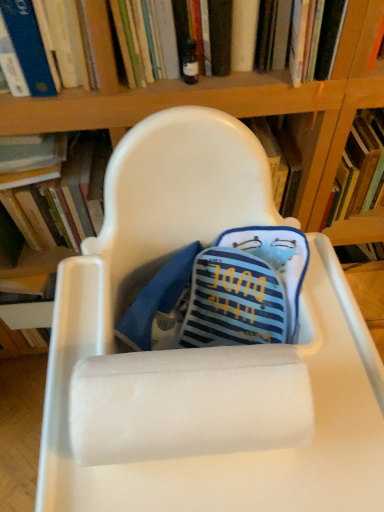
Question: Does white fluffy paper towel at center have a lesser height compared to hardcover book at upper center, the 1th book viewed from the right?

Choices:
 (A) no
 (B) yes

Answer: (B)

Question: Is white fluffy paper towel at center further to the viewer compared to hardcover book at upper center, the 3th book in the left-to-right sequence?

Choices:
 (A) no
 (B) yes

Answer: (A)

Question: Is white fluffy paper towel at center to the right of hardcover book at upper center, the 1th book viewed from the right, from the viewer's perspective?

Choices:
 (A) yes
 (B) no

Answer: (B)

Question: Could hardcover book at upper center, the 1th book viewed from the right, be considered to be inside white fluffy paper towel at center?

Choices:
 (A) yes
 (B) no

Answer: (B)

Question: Is white fluffy paper towel at center outside hardcover book at upper center, the 1th book viewed from the right?

Choices:
 (A) no
 (B) yes

Answer: (B)

Question: Is white fluffy paper towel at center not close to hardcover book at upper center, the 1th book viewed from the right?

Choices:
 (A) no
 (B) yes

Answer: (A)

Question: Considering the relative sizes of hardcover book at left, which is the third book from right to left, and hardcover book at upper center, the 1th book viewed from the right, in the image provided, is hardcover book at left, which is the third book from right to left, bigger than hardcover book at upper center, the 1th book viewed from the right,?

Choices:
 (A) yes
 (B) no

Answer: (A)

Question: Is hardcover book at left, which is the third book from right to left, taller than hardcover book at upper center, the 1th book viewed from the right?

Choices:
 (A) no
 (B) yes

Answer: (B)

Question: Can you confirm if hardcover book at left, the first book from the left, is wider than hardcover book at upper center, the 1th book viewed from the right?

Choices:
 (A) no
 (B) yes

Answer: (A)

Question: Would you say hardcover book at upper center, the 3th book in the left-to-right sequence, is part of hardcover book at left, which is the third book from right to left,'s contents?

Choices:
 (A) no
 (B) yes

Answer: (A)

Question: Is hardcover book at left, the first book from the left, positioned in front of hardcover book at upper center, the 3th book in the left-to-right sequence?

Choices:
 (A) no
 (B) yes

Answer: (A)

Question: Is the position of hardcover book at left, the first book from the left, more distant than that of hardcover book at upper center, the 1th book viewed from the right?

Choices:
 (A) yes
 (B) no

Answer: (A)

Question: From a real-world perspective, is blue hardcover book at upper left, the 2th book viewed from the right, on top of hardcover book at upper center, the 1th book viewed from the right?

Choices:
 (A) no
 (B) yes

Answer: (B)